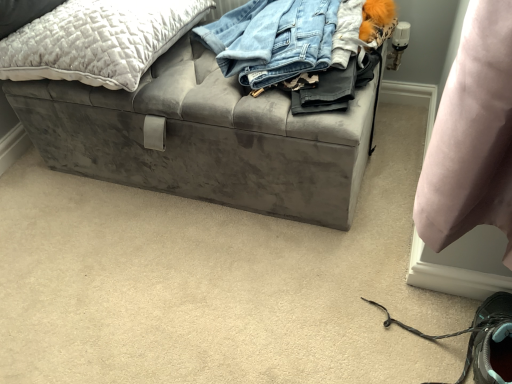
Where is `vacant area that is in front of velvet gray storage bench at center`? vacant area that is in front of velvet gray storage bench at center is located at coordinates (193, 283).